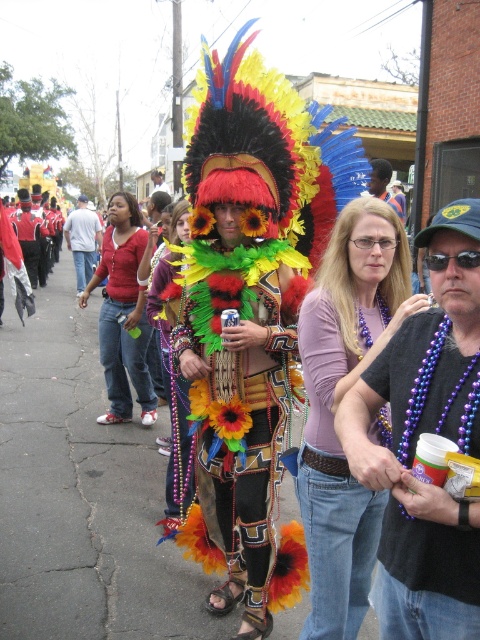
Question: Is brushed metal can at center to the right of matte floral dress at center from the viewer's perspective?

Choices:
 (A) no
 (B) yes

Answer: (A)

Question: Can you confirm if purple beaded necklace at center is bigger than brushed metal can at center?

Choices:
 (A) yes
 (B) no

Answer: (B)

Question: Which object is the closest to the floral fabric headdress at center?

Choices:
 (A) matte black hat at center
 (B) matte black shirt at center
 (C) matte floral dress at center

Answer: (C)

Question: Which of the following is the farthest from the observer?

Choices:
 (A) (107, 372)
 (B) (263, 346)
 (C) (362, 285)

Answer: (A)

Question: Which object is the farthest from the matte black hat at center?

Choices:
 (A) purple beaded necklace at center
 (B) brushed metal can at center
 (C) matte floral dress at center
 (D) purple beaded necklace at lower right

Answer: (D)

Question: Can you confirm if floral fabric headdress at center is positioned to the left of matte black shirt at center?

Choices:
 (A) yes
 (B) no

Answer: (B)